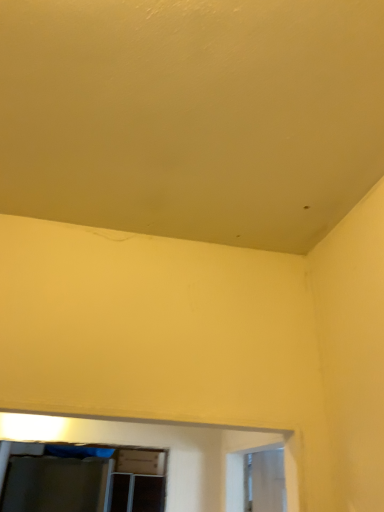
Where is `clear plastic screen door at lower center`? clear plastic screen door at lower center is located at coordinates [137, 493].

Describe the element at coordinates (137, 493) in the screenshot. This screenshot has width=384, height=512. I see `clear plastic screen door at lower center` at that location.

Find the location of a particular element. Image resolution: width=384 pixels, height=512 pixels. clear plastic screen door at lower center is located at coordinates (137, 493).